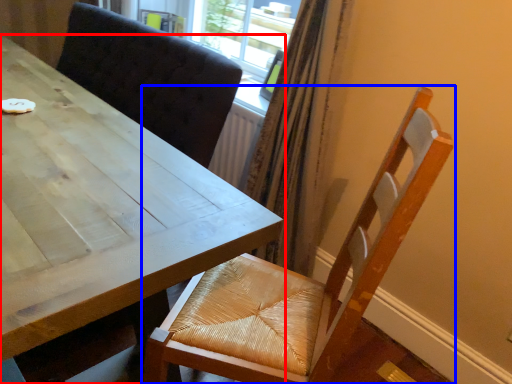
Question: Which of the following is the farthest to the observer, table (highlighted by a red box) or chair (highlighted by a blue box)?

Choices:
 (A) table
 (B) chair

Answer: (B)